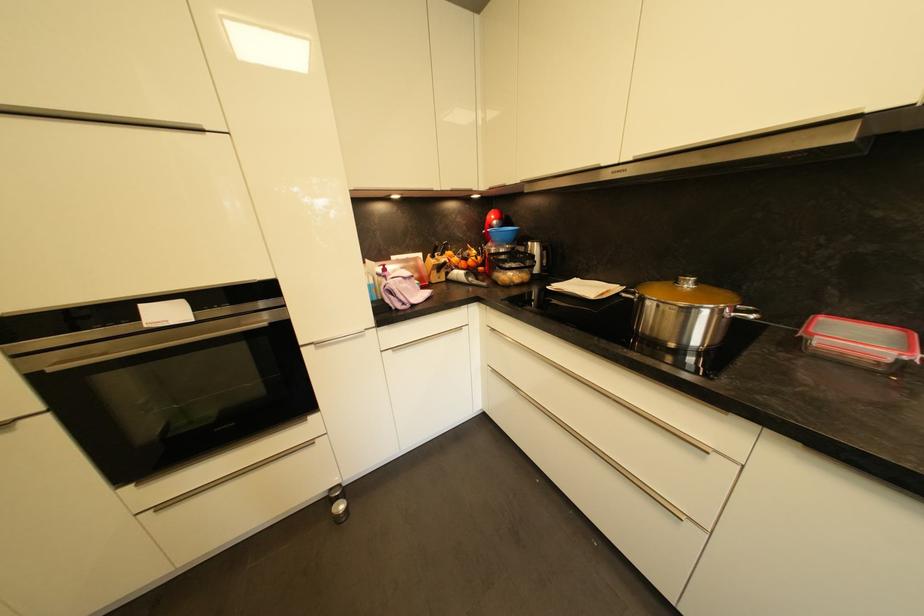
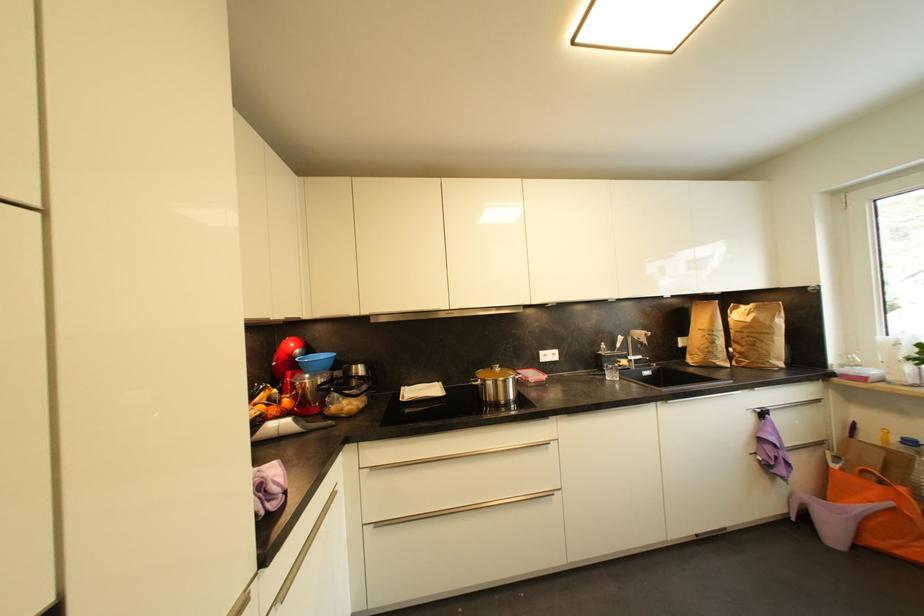
In the second image, find the point that corresponds to pixel 499 373 in the first image.

(382, 527)